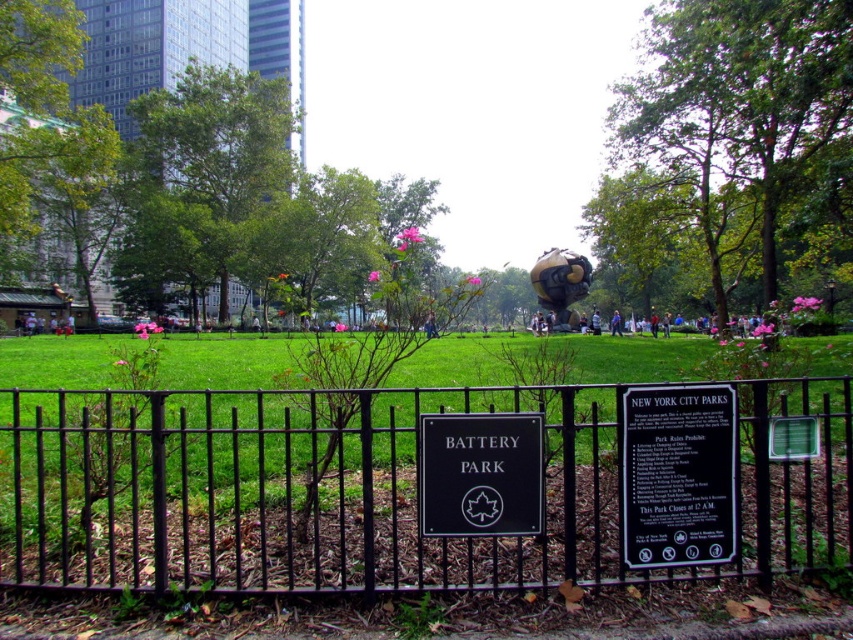
Question: Estimate the real-world distances between objects in this image. Which object is closer to the green leafy tree at center?

Choices:
 (A) green matte sign at center
 (B) black metal fence at center
 (C) black plastic sign at center

Answer: (C)

Question: Considering the real-world distances, which object is farthest from the green leafy tree at center?

Choices:
 (A) green matte sign at center
 (B) black polished stone sign at center
 (C) black metal fence at center

Answer: (C)

Question: Can you confirm if black metal fence at center is positioned above green leafy tree at upper left?

Choices:
 (A) yes
 (B) no

Answer: (B)

Question: Is black metal fence at center bigger than black polished stone sign at center?

Choices:
 (A) yes
 (B) no

Answer: (A)

Question: Which object appears closest to the camera in this image?

Choices:
 (A) black metal fence at center
 (B) green matte sign at center

Answer: (B)

Question: Is black metal fence at center below black plastic sign at center?

Choices:
 (A) yes
 (B) no

Answer: (A)